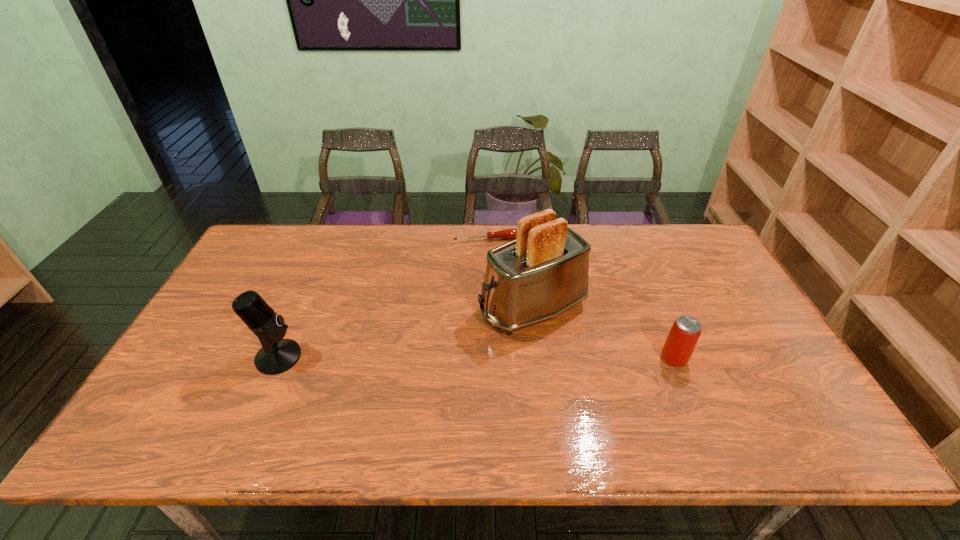
Locate an element on the screen. free space between the screwdriver and the third shortest object is located at coordinates (383, 298).

Identify the location of object that is the third closest to the tallest object. (277, 355).

Select which object appears as the closest to the farthest object. Please provide its 2D coordinates. Your answer should be formatted as a tuple, i.e. [(x, y)], where the tuple contains the x and y coordinates of a point satisfying the conditions above.

[(542, 273)]

Image resolution: width=960 pixels, height=540 pixels. I want to click on free space that satisfies the following two spatial constraints: 1. on the front side of the rightmost object; 2. on the right side of the toaster, so click(x=540, y=359).